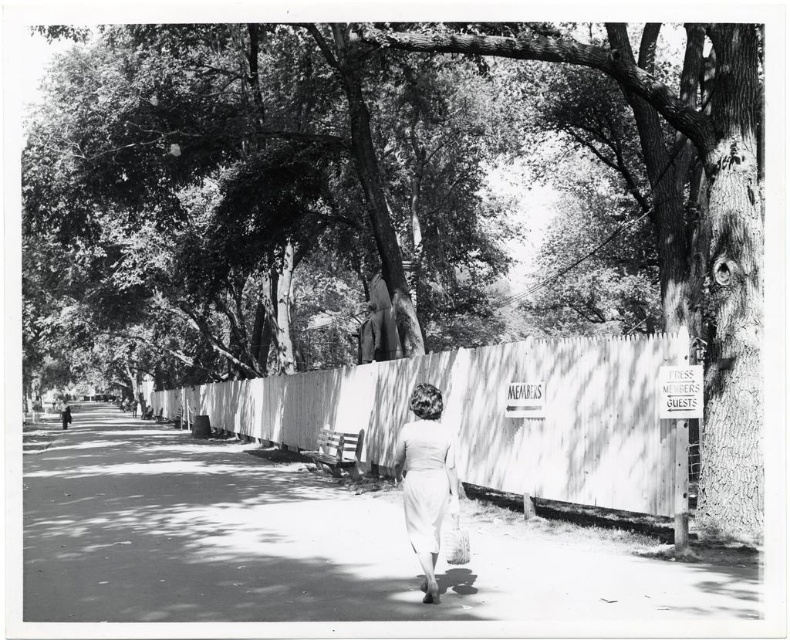
Does point (527, 593) lie in front of point (409, 474)?

No, it is behind (409, 474).

The image size is (790, 640). What do you see at coordinates (307, 545) in the screenshot?
I see `smooth concrete path at center` at bounding box center [307, 545].

Locate an element on the screen. This screenshot has width=790, height=640. smooth concrete path at center is located at coordinates (307, 545).

In the scene shown: Is white wood fence at center closer to the viewer compared to white cotton dress at center?

Yes.

Does white wood fence at center appear under white cotton dress at center?

No, white wood fence at center is not below white cotton dress at center.

Does point (261, 419) come behind point (70, 420)?

No.

The image size is (790, 640). In order to click on white wood fence at center in this screenshot , I will do `click(486, 413)`.

Does point (36, 586) lie behind point (499, 394)?

No, it is in front of (499, 394).

Does smooth concrete path at center appear over white wood fence at center?

Incorrect, smooth concrete path at center is not positioned above white wood fence at center.

Which is behind, point (224, 502) or point (463, 394)?

The point (224, 502) is behind.

The width and height of the screenshot is (790, 640). I want to click on smooth concrete path at center, so click(x=307, y=545).